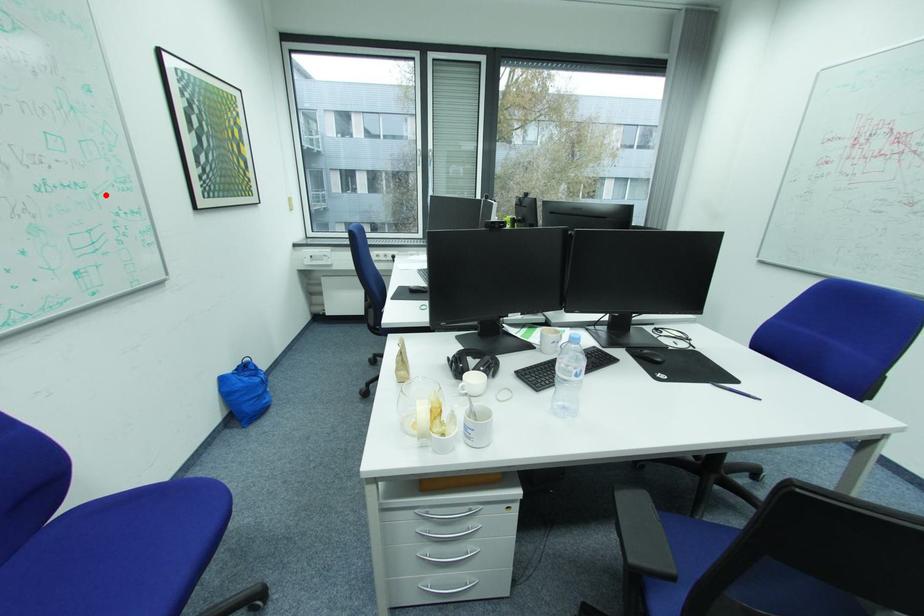
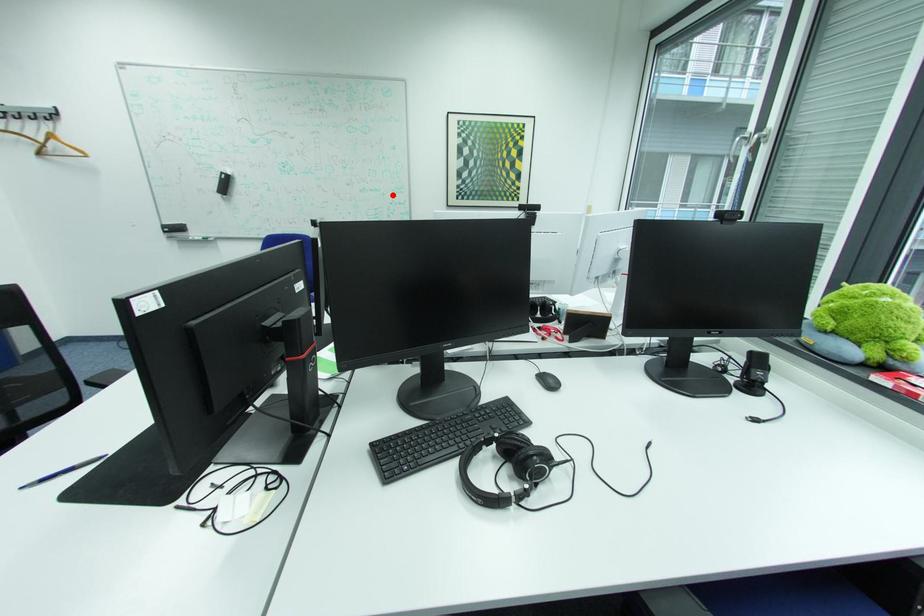
I am providing you with two images of the same scene from different viewpoints. A red point is marked on the first image and another point is marked on the second image. Is the red point in image1 aligned with the point shown in image2?

Yes